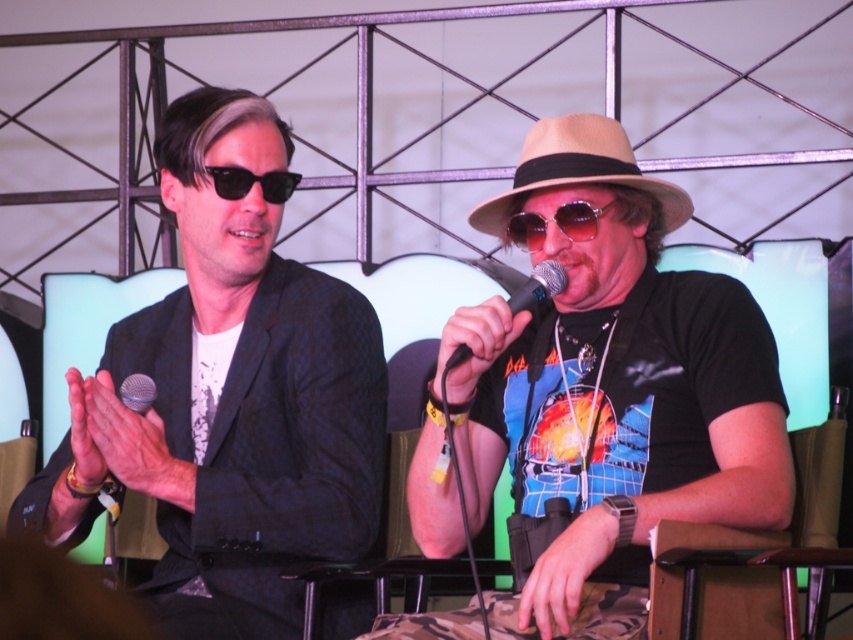
Between matte black suit at left and black reflective sunglasses at left, which one is positioned lower?

Positioned lower is matte black suit at left.

Who is more forward, (322, 516) or (236, 180)?

Point (322, 516)

Is point (374, 378) positioned behind point (297, 180)?

No.

Where is `matte black suit at left`? matte black suit at left is located at coordinates (229, 397).

Which is below, shiny black microphone at center or matte black suit at left?

shiny black microphone at center

Can you confirm if shiny black microphone at center is positioned above matte black suit at left?

Actually, shiny black microphone at center is below matte black suit at left.

The width and height of the screenshot is (853, 640). Identify the location of shiny black microphone at center. (602, 396).

Is shiny purple goggles at center to the right of black reflective sunglasses at left from the viewer's perspective?

Correct, you'll find shiny purple goggles at center to the right of black reflective sunglasses at left.

Does shiny purple goggles at center have a greater width compared to black reflective sunglasses at left?

Correct, the width of shiny purple goggles at center exceeds that of black reflective sunglasses at left.

At what (x,y) coordinates should I click in order to perform the action: click on shiny purple goggles at center. Please return your answer as a coordinate pair (x, y). Looking at the image, I should click on tap(578, 220).